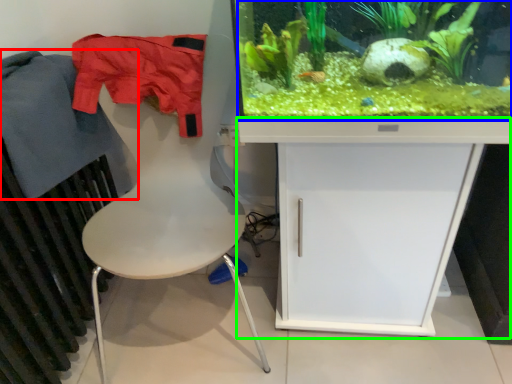
Question: Based on their relative distances, which object is farther from clothing (highlighted by a red box)? Choose from plant (highlighted by a blue box) and computer desk (highlighted by a green box).

Choices:
 (A) plant
 (B) computer desk

Answer: (B)